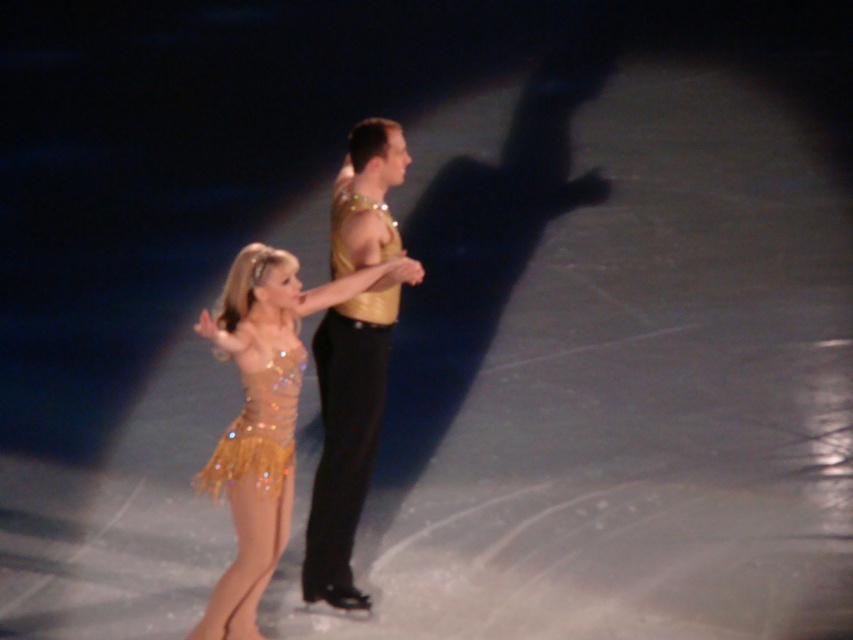
You are a photographer at the back of the ice rink. You need to capture a photo where both the sparkly gold dress at center and the gold sequined dress at center are visible. Which dress should you focus on first to ensure both are in frame?

You should focus on the sparkly gold dress at center first because it is taller than the gold sequined dress at center, so positioning it properly will help ensure both are visible in the frame.

You are a photographer at the back of the rink and want to capture both the sparkly gold dress at center and the gold shiny suit at center in a single shot. Which skater should you focus on first to ensure both are in frame?

The sparkly gold dress at center is positioned on the left side of gold shiny suit at center, so you should focus on the gold shiny suit at center first to ensure both are in frame.

You are a photographer positioned at the origin point of the coordinate system. You want to take a photo of the gold shiny suit at center. What are the coordinates where you should aim your camera to capture it?

The gold shiny suit at center is located at coordinates point (347, 432), so you should aim your camera at those coordinates to capture it.